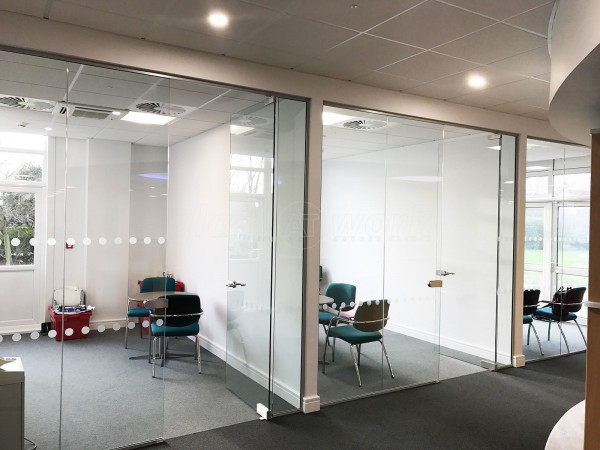
Image resolution: width=600 pixels, height=450 pixels. In order to click on light in this screenshot , I will do `click(477, 85)`, `click(223, 32)`, `click(141, 120)`, `click(330, 115)`.